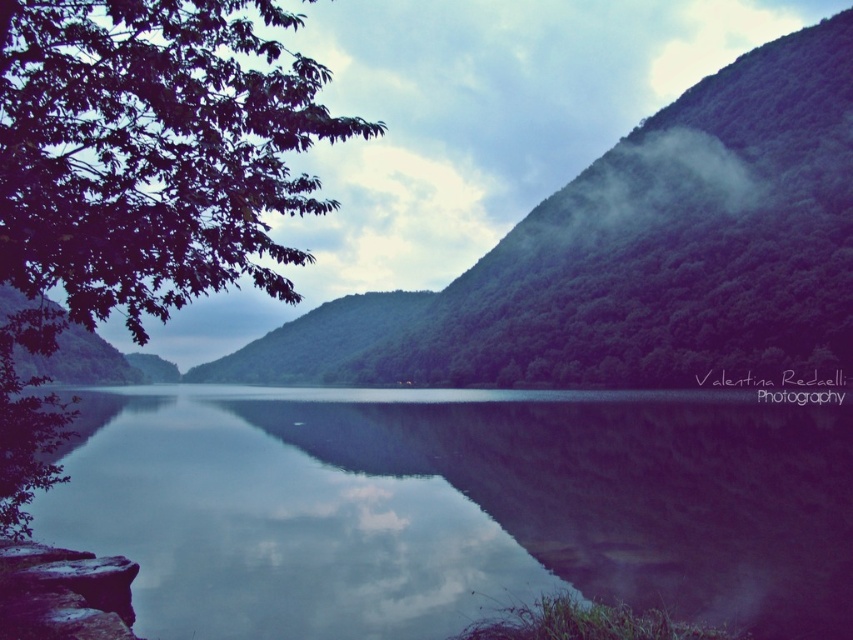
Question: Can you confirm if glossy water at center is positioned above green leafy tree at left?

Choices:
 (A) no
 (B) yes

Answer: (A)

Question: Which point appears closest to the camera in this image?

Choices:
 (A) (254, 141)
 (B) (219, 444)

Answer: (A)

Question: Which is farther from the green leafy hillside at upper left?

Choices:
 (A) green leafy tree at left
 (B) glossy water at center

Answer: (A)

Question: From the image, what is the correct spatial relationship of glossy water at center in relation to green leafy tree at left?

Choices:
 (A) left
 (B) right

Answer: (B)

Question: Which point is closer to the camera taking this photo?

Choices:
 (A) (363, 563)
 (B) (543, 332)
 (C) (140, 339)

Answer: (C)

Question: Can you confirm if glossy water at center is bigger than green leafy tree at left?

Choices:
 (A) no
 (B) yes

Answer: (A)